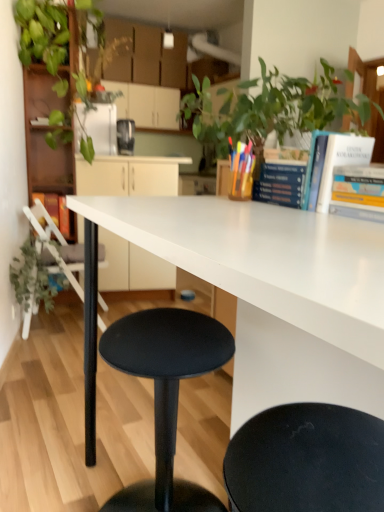
Measure the distance between hardcover book at center, positioned as the 2th book in back-to-front order, and camera.

hardcover book at center, positioned as the 2th book in back-to-front order, is 1.26 meters from camera.

Image resolution: width=384 pixels, height=512 pixels. Describe the element at coordinates (49, 240) in the screenshot. I see `white matte chair at lower left` at that location.

In the scene shown: How much space does matte white cabinets at center, arranged as the 1th cabinetry when viewed from the front, occupy horizontally?

13.66 inches.

Locate an element on the screen. hardcover book at center, which ranks as the 3th book in front-to-back order is located at coordinates (282, 177).

Is matte white cabinets at center, arranged as the 1th cabinetry when viewed from the front, looking in the opposite direction of white glossy countertop at center?

No, matte white cabinets at center, arranged as the 1th cabinetry when viewed from the front,'s orientation is not away from white glossy countertop at center.

How many degrees apart are the facing directions of matte white cabinets at center, the 1th cabinetry positioned from the bottom, and white glossy countertop at center?

There is a 74-degree angle between the facing directions of matte white cabinets at center, the 1th cabinetry positioned from the bottom, and white glossy countertop at center.

Which of these two, matte white cabinets at center, the 1th cabinetry positioned from the bottom, or white glossy countertop at center, is wider?

With larger width is white glossy countertop at center.

From the picture: From the image's perspective, relative to white glossy countertop at center, is matte white cabinets at center, the 2th cabinetry from the top, above or below?

Clearly, from the image's perspective, matte white cabinets at center, the 2th cabinetry from the top, is above white glossy countertop at center.

Which of these two, white glossy countertop at center or matte black stool at lower center, is thinner?

Thinner between the two is matte black stool at lower center.

I want to click on countertop that is in front of the matte black stool at lower center, so click(x=266, y=259).

Considering the positions of objects white glossy countertop at center and matte black stool at lower center in the image provided, who is more to the left, white glossy countertop at center or matte black stool at lower center?

matte black stool at lower center.

Between white glossy countertop at center and matte black stool at lower center, which one is positioned in front?

white glossy countertop at center is in front.

Considering the relative positions of white matte chair at lower left and green matte plant at left in the image provided, is white matte chair at lower left to the left or to the right of green matte plant at left?

In the image, white matte chair at lower left appears on the right side of green matte plant at left.

Locate an element on the screen. This screenshot has width=384, height=512. chair behind the green matte plant at left is located at coordinates (49, 240).

Considering the points (61, 234) and (29, 253), which point is behind, point (61, 234) or point (29, 253)?

Point (61, 234)

From the image's perspective, is white matte chair at lower left above or below green matte plant at left?

From the image's perspective, white matte chair at lower left appears above green matte plant at left.

Measure the distance from matte black stool at lower center to hardcover book at center, which ranks as the 3th book in front-to-back order.

25.85 inches.

Between point (140, 505) and point (260, 200), which one is positioned behind?

Point (260, 200)

From the image's perspective, is matte black stool at lower center beneath hardcover book at center, placed as the third book when sorted from right to left?

Indeed, from the image's perspective, matte black stool at lower center is shown beneath hardcover book at center, placed as the third book when sorted from right to left.

From a real-world perspective, is matte black stool at lower center physically located above or below hardcover book at center, the 2th book from the left?

In terms of real-world spatial position, matte black stool at lower center is below hardcover book at center, the 2th book from the left.

How different are the orientations of hardcover book at upper right, the 4th book viewed from the back, and matte white cabinets at center, arranged as the 1th cabinetry when viewed from the front, in degrees?

74.4 degrees separate the facing orientations of hardcover book at upper right, the 4th book viewed from the back, and matte white cabinets at center, arranged as the 1th cabinetry when viewed from the front.

Between hardcover book at upper right, marked as the 4th book in a left-to-right arrangement, and matte white cabinets at center, the 1th cabinetry positioned from the bottom, which one has smaller width?

Thinner between the two is hardcover book at upper right, marked as the 4th book in a left-to-right arrangement.

From the image's perspective, is hardcover book at upper right, which appears as the first book when viewed from the front, over matte white cabinets at center, arranged as the 1th cabinetry when viewed from the front?

Incorrect, from the image's perspective, hardcover book at upper right, which appears as the first book when viewed from the front, is lower than matte white cabinets at center, arranged as the 1th cabinetry when viewed from the front.

From a real-world perspective, between hardcover book at upper right, which appears as the 1th book when viewed from the right, and matte white cabinets at center, arranged as the 1th cabinetry when viewed from the front, who is vertically higher?

From a 3D spatial view, hardcover book at upper right, which appears as the 1th book when viewed from the right, is above.

Identify the location of houseplant above the hardcover book at left, placed as the fourth book when sorted from right to left (from the image's perspective). Image resolution: width=384 pixels, height=512 pixels. 270,108.

Between point (236, 110) and point (62, 225), which one is positioned behind?

The point (62, 225) is farther.

Which is more to the right, green leafy plant at upper center or hardcover book at left, placed as the first book when sorted from left to right?

A: green leafy plant at upper center is more to the right.

Considering the relative sizes of green leafy plant at upper center and hardcover book at left, placed as the fourth book when sorted from right to left, in the image provided, is green leafy plant at upper center taller than hardcover book at left, placed as the fourth book when sorted from right to left,?

Correct, green leafy plant at upper center is much taller as hardcover book at left, placed as the fourth book when sorted from right to left.

Does matte black stool at lower center lie in front of metallic black toaster at upper center?

Yes, the depth of matte black stool at lower center is less than that of metallic black toaster at upper center.

Is matte black stool at lower center situated inside metallic black toaster at upper center or outside?

matte black stool at lower center cannot be found inside metallic black toaster at upper center.

Which of these two, matte black stool at lower center or metallic black toaster at upper center, is thinner?

metallic black toaster at upper center is thinner.

Which of these two, matte black stool at lower center or metallic black toaster at upper center, stands taller?

Standing taller between the two is matte black stool at lower center.

The image size is (384, 512). I want to click on cabinetry that is the 1st object above the white glossy countertop at center (from a real-world perspective), so click(x=128, y=176).

Locate an element on the screen. stool behind the white glossy countertop at center is located at coordinates (166, 394).

Estimate the real-world distances between objects in this image. Which object is further from matte white cabinets at upper center, which is counted as the second cabinetry, starting from the bottom, hardcover book at upper right, placed as the third book when sorted from back to front, or white glossy countertop at center?

The object further to matte white cabinets at upper center, which is counted as the second cabinetry, starting from the bottom, is white glossy countertop at center.

From the image, which object appears to be farther from hardcover book at left, placed as the fourth book when sorted from right to left, white glossy countertop at center or hardcover book at center, positioned as the 2th book in back-to-front order?

The object further to hardcover book at left, placed as the fourth book when sorted from right to left, is white glossy countertop at center.

Consider the image. When comparing their distances from hardcover book at upper right, the 4th book viewed from the back, does green leafy plant at upper center or white glossy countertop at center seem closer?

Based on the image, white glossy countertop at center appears to be nearer to hardcover book at upper right, the 4th book viewed from the back.

Based on the photo, from the image, which object appears to be nearer to hardcover book at left, placed as the first book when sorted from left to right, matte white cabinets at upper center, positioned as the first cabinetry in back-to-front order, or white matte chair at lower left?

white matte chair at lower left lies closer to hardcover book at left, placed as the first book when sorted from left to right, than the other object.

Looking at the image, which one is located further to metallic black toaster at upper center, white matte chair at lower left or matte black stool at lower center?

matte black stool at lower center is positioned further to the anchor metallic black toaster at upper center.

From the image, which object appears to be nearer to matte white cabinets at upper center, positioned as the first cabinetry in back-to-front order, green leafy plant at upper center or white matte chair at lower left?

The object closer to matte white cabinets at upper center, positioned as the first cabinetry in back-to-front order, is white matte chair at lower left.

Estimate the real-world distances between objects in this image. Which object is further from hardcover book at upper right, marked as the 4th book in a left-to-right arrangement, white glossy countertop at center or hardcover book at left, placed as the fourth book when sorted from right to left?

Based on the image, hardcover book at left, placed as the fourth book when sorted from right to left, appears to be further to hardcover book at upper right, marked as the 4th book in a left-to-right arrangement.

From the picture: Estimate the real-world distances between objects in this image. Which object is further from green leafy plant at upper center, white glossy countertop at center or green leafy plant at upper left?

green leafy plant at upper left is further to green leafy plant at upper center.

At what (x,y) coordinates should I click in order to perform the action: click on chair between hardcover book at center, positioned as the 2th book in back-to-front order, and matte white cabinets at center, the 2th cabinetry from the top, in the front-back direction. Please return your answer as a coordinate pair (x, y). Looking at the image, I should click on (49, 240).

Where is `chair between green leafy plant at upper center and hardcover book at left, placed as the fourth book when sorted from right to left, along the z-axis`? chair between green leafy plant at upper center and hardcover book at left, placed as the fourth book when sorted from right to left, along the z-axis is located at coordinates (49, 240).

Find the location of `vegetation between white matte chair at lower left and hardcover book at center, the 2th book from the left`. vegetation between white matte chair at lower left and hardcover book at center, the 2th book from the left is located at coordinates (44, 37).

At what (x,y) coordinates should I click in order to perform the action: click on cabinetry positioned between matte black stool at lower center and hardcover book at left, placed as the first book when sorted from left to right, from near to far. Please return your answer as a coordinate pair (x, y). Looking at the image, I should click on (128, 176).